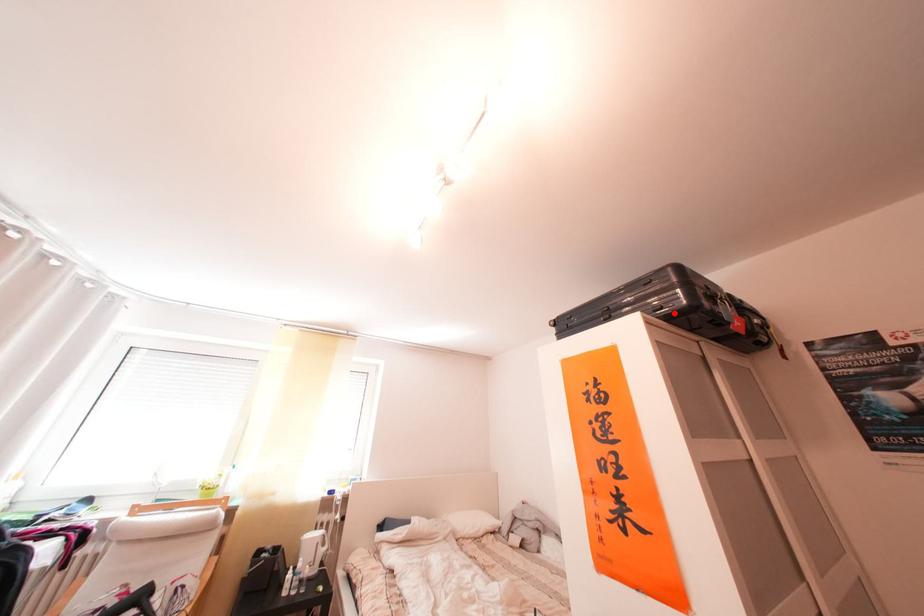
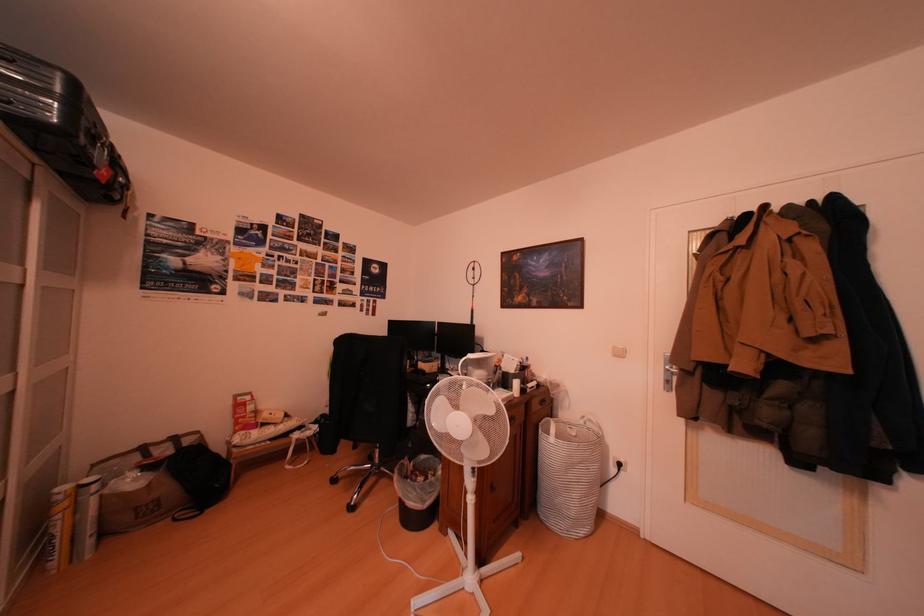
Find the pixel in the second image that matches the highlighted location in the first image.

(19, 108)